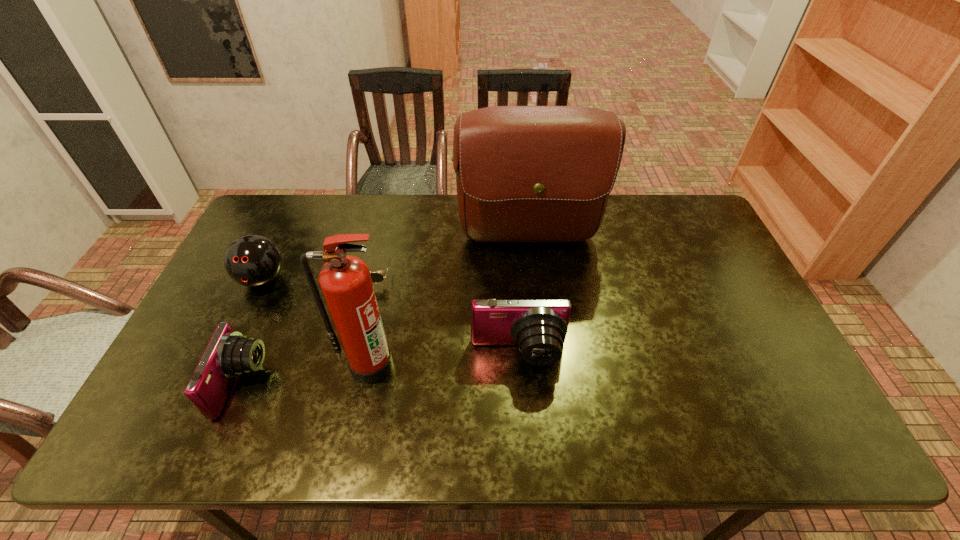
You are a GUI agent. You are given a task and a screenshot of the screen. Output one action in this format:
    pyautogui.click(x=<x>, y=<y>)
    Task: Click on the second closest object to the shortest object
    This screenshot has height=540, width=960.
    Given the screenshot: What is the action you would take?
    pyautogui.click(x=523, y=173)

You are a GUI agent. You are given a task and a screenshot of the screen. Output one action in this format:
    pyautogui.click(x=<x>, y=<y>)
    Task: Click on the vacant space that satisfies the following two spatial constraints: 1. on the front-facing side of the right camera; 2. on the front-facing side of the shorter camera
    
    Given the screenshot: What is the action you would take?
    pyautogui.click(x=520, y=383)